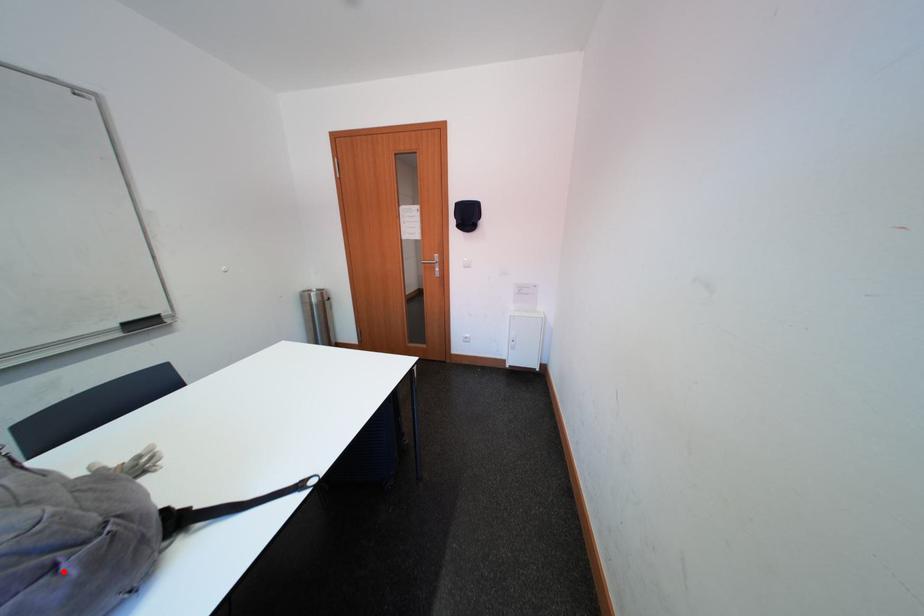
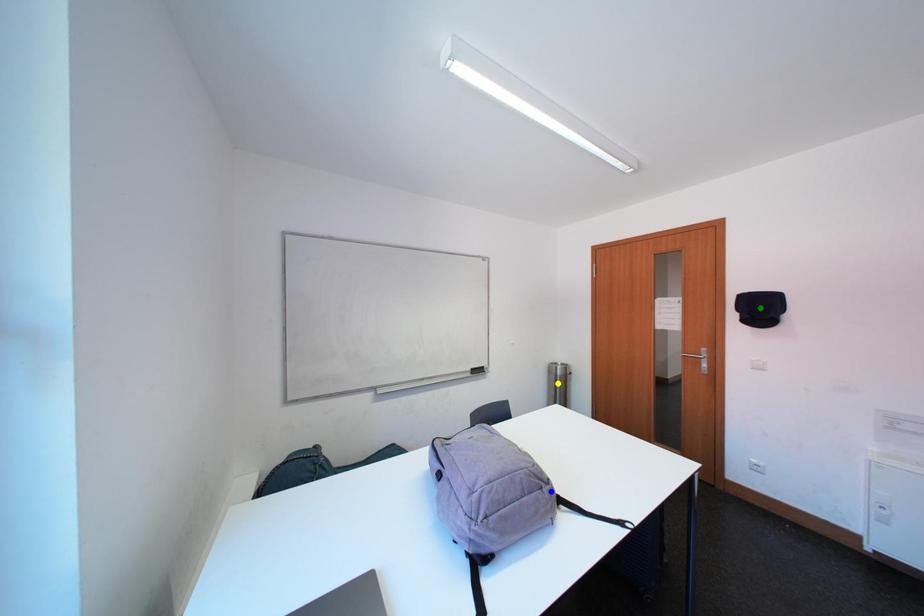
Question: I am providing you with two images of the same scene from different viewpoints. A red point is marked on the first image. You are given multiple points on the second image. Which point in image 2 represents the same 3d spot as the red point in image 1?

Choices:
 (A) green point
 (B) yellow point
 (C) blue point

Answer: (C)